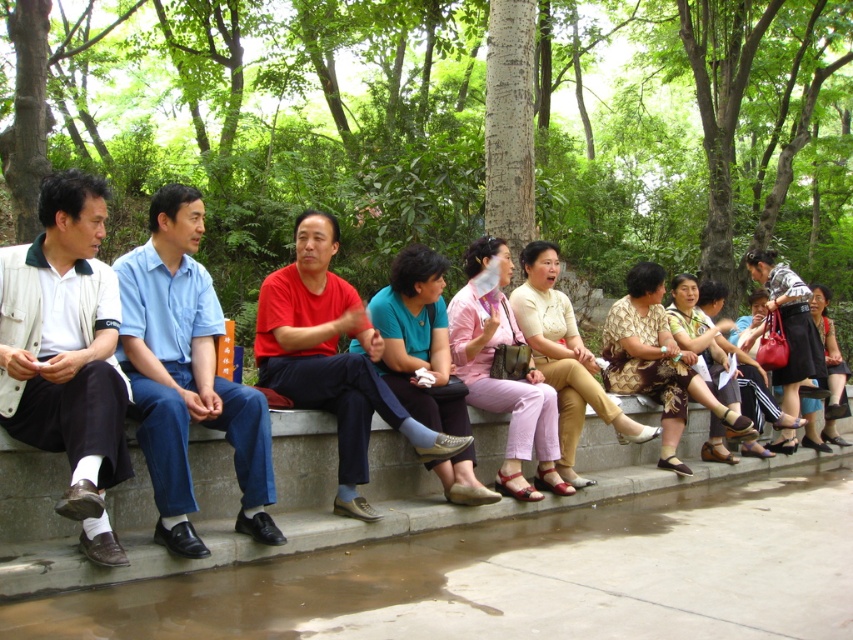
You are a photographer trying to capture a candid shot of the light beige jacket at left and the blue cotton shirt at center. Your camera has a minimum focus distance of 45 centimeters. Can you focus on both subjects simultaneously without moving the camera?

The light beige jacket at left and blue cotton shirt at center are 45.72 centimeters apart. Since the distance between them is slightly more than the camera minimum focus distance of 45 centimeters, you can focus on both subjects simultaneously without moving the camera.

You are a photographer trying to capture a group photo of the people on the bench. You notice the blue cotton shirt at center and the red matte shirt at center. Which person should you ask to move slightly forward to ensure both are in focus?

The blue cotton shirt at center is taller than the red matte shirt at center. To ensure both are in focus, ask the taller person, the blue cotton shirt at center, to move slightly forward so their head aligns with the red matte shirt at center.

You are a photographer standing at the edge of the paved pathway in the park. You want to take a photo of the red matte shirt at center while ensuring the gray concrete curb at lower center is visible in the frame. Based on their positions, will you need to adjust your camera angle upwards or downwards to include both subjects?

The gray concrete curb at lower center is positioned under the red matte shirt at center. To include both in the frame, you would need to adjust your camera angle upwards so the shirt remains in view while the curb stays visible below.